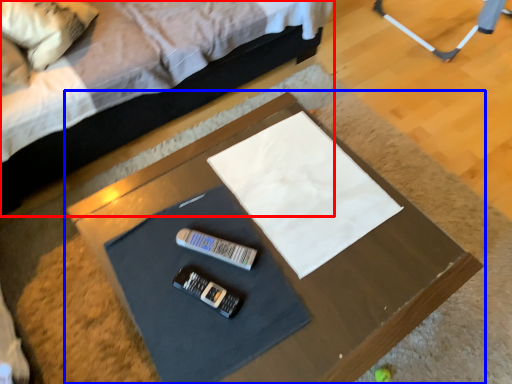
Question: Among these objects, which one is farthest to the camera, bed (highlighted by a red box) or table (highlighted by a blue box)?

Choices:
 (A) bed
 (B) table

Answer: (A)